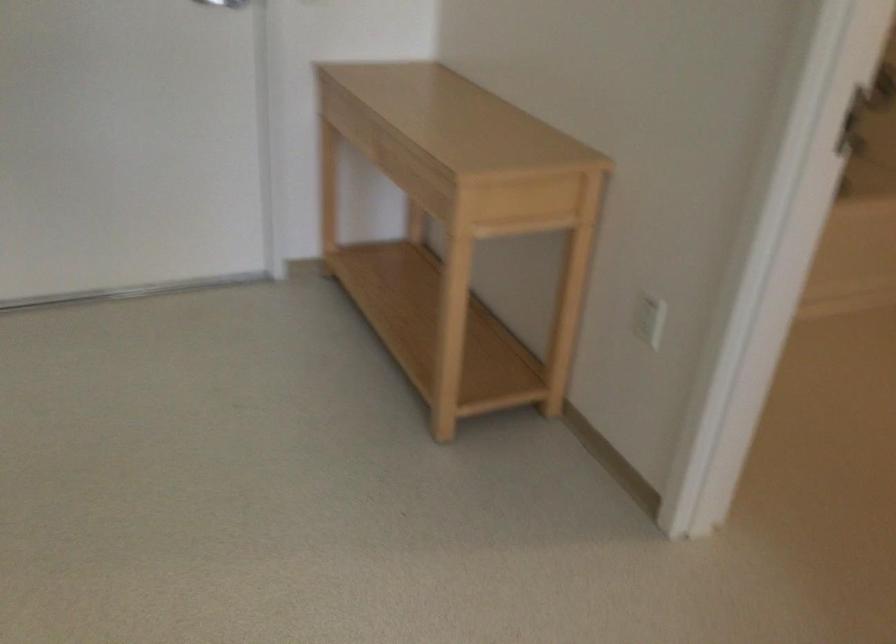
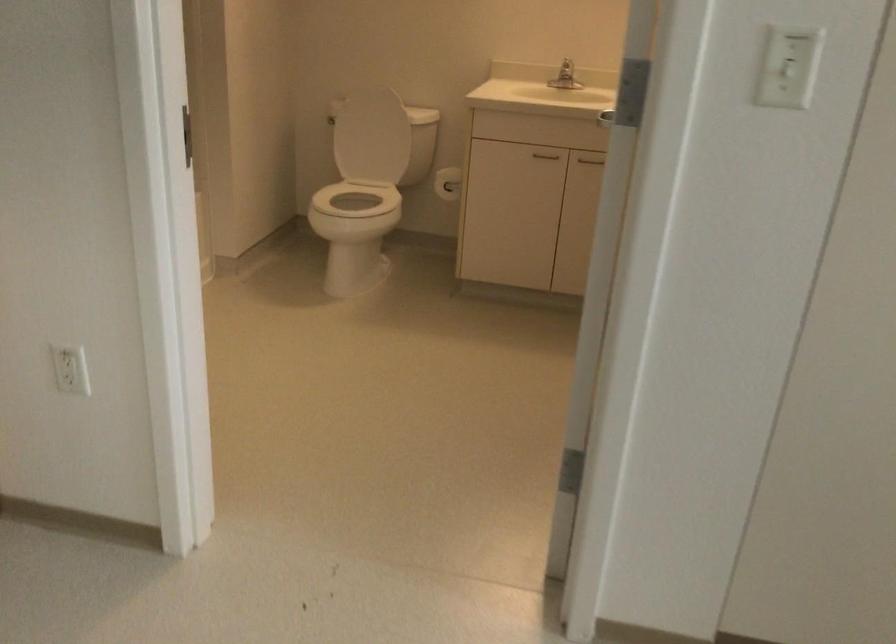
Question: The first image is from the beginning of the video and the second image is from the end. How did the camera likely rotate when shooting the video?

Choices:
 (A) Left
 (B) Right
 (C) Up
 (D) Down

Answer: (B)